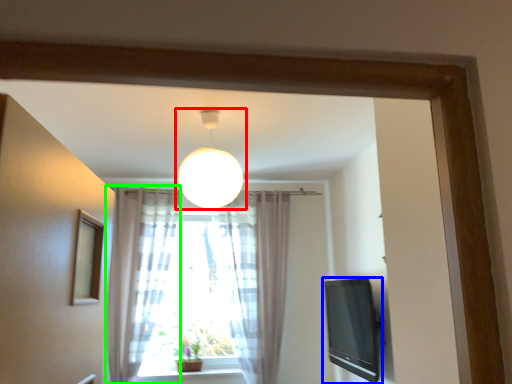
Question: Which object is the closest to the lamp (highlighted by a red box)? Choose among these: television (highlighted by a blue box) or curtain (highlighted by a green box).

Choices:
 (A) television
 (B) curtain

Answer: (B)